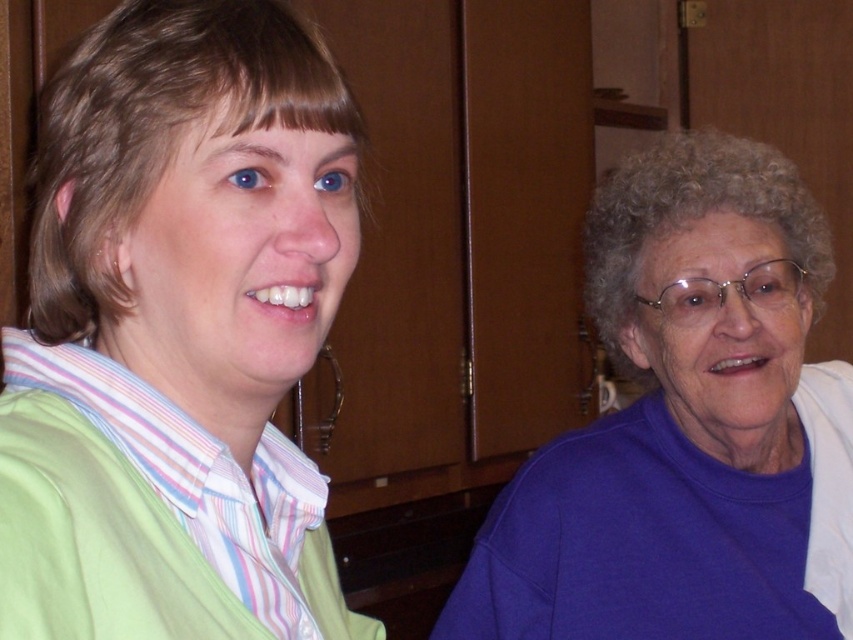
You are organizing a clothing store and need to arrange the purple matte sweater at center and the purple matte sweater at right on a rack. Which sweater should you place on the lower hanger to ensure proper display?

The purple matte sweater at center should be placed on the lower hanger because it has a lesser height compared to the purple matte sweater at right.

You are helping organize a clothing store and need to arrange the purple matte sweater at center and the purple matte sweater at right on a rack. Based on their sizes, which one should be placed on the left side of the rack to ensure proper spacing?

The purple matte sweater at center has a lesser width compared to the purple matte sweater at right, so placing the narrower purple matte sweater at center on the left side would allow enough space for the wider purple matte sweater at right next to it.